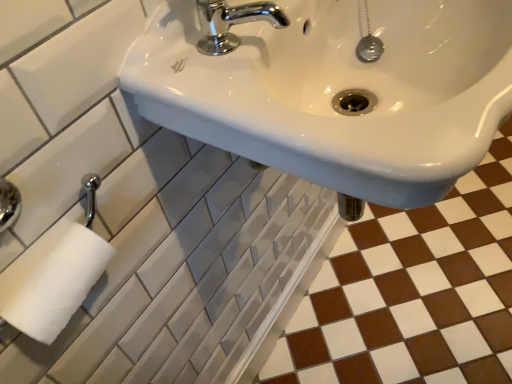
The image size is (512, 384). Find the location of `free space above brown glossy tile at lower right (from a real-world perspective)`. free space above brown glossy tile at lower right (from a real-world perspective) is located at coordinates (426, 281).